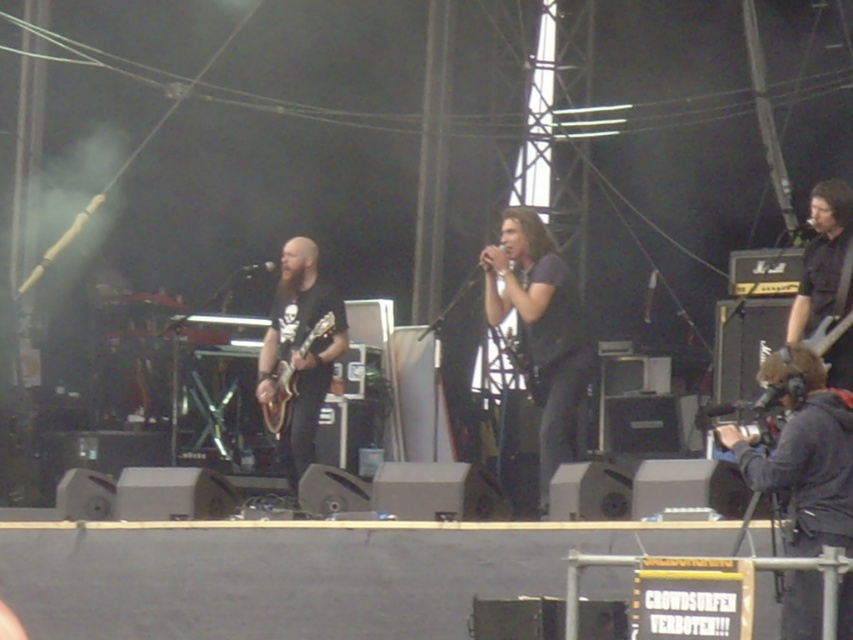
Question: Estimate the real-world distances between objects in this image. Which object is closer to the dark gray shirt at center?

Choices:
 (A) black matte guitar at right
 (B) black matte guitar at center

Answer: (A)

Question: Can you confirm if dark gray shirt at center is thinner than black matte guitar at center?

Choices:
 (A) yes
 (B) no

Answer: (B)

Question: Can you confirm if black leather jacket at lower right is positioned above metallic silver guitar at right?

Choices:
 (A) no
 (B) yes

Answer: (A)

Question: Is black matte guitar at center wider than glossy electric guitar at center?

Choices:
 (A) no
 (B) yes

Answer: (B)

Question: Which object is closer to the camera taking this photo?

Choices:
 (A) black leather jacket at lower right
 (B) dark gray shirt at center

Answer: (A)

Question: Which point is farther to the camera?

Choices:
 (A) 821,243
 (B) 543,481
 (C) 817,328

Answer: (B)